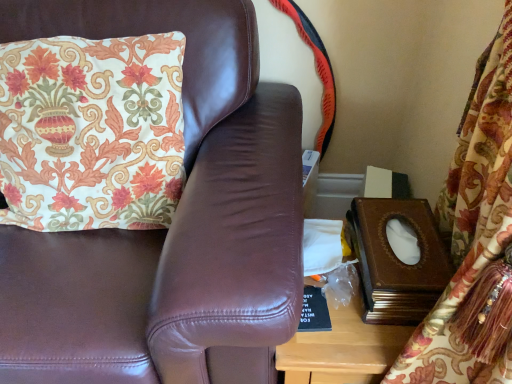
Question: Is brown leather couch at upper left oriented away from floral fabric cushion at upper left?

Choices:
 (A) no
 (B) yes

Answer: (B)

Question: Is brown leather couch at upper left aimed at floral fabric cushion at upper left?

Choices:
 (A) no
 (B) yes

Answer: (B)

Question: Considering the relative sizes of brown leather couch at upper left and floral fabric cushion at upper left in the image provided, is brown leather couch at upper left shorter than floral fabric cushion at upper left?

Choices:
 (A) yes
 (B) no

Answer: (B)

Question: From the image's perspective, does brown leather couch at upper left appear lower than floral fabric cushion at upper left?

Choices:
 (A) no
 (B) yes

Answer: (B)

Question: Considering the relative sizes of brown leather couch at upper left and floral fabric cushion at upper left in the image provided, is brown leather couch at upper left wider than floral fabric cushion at upper left?

Choices:
 (A) yes
 (B) no

Answer: (A)

Question: Is brown leather couch at upper left at the left side of floral fabric cushion at upper left?

Choices:
 (A) no
 (B) yes

Answer: (B)

Question: Is floral fabric cushion at upper left positioned far away from brown leather couch at upper left?

Choices:
 (A) no
 (B) yes

Answer: (A)

Question: Considering the relative positions of floral fabric cushion at upper left and brown leather couch at upper left in the image provided, is floral fabric cushion at upper left in front of brown leather couch at upper left?

Choices:
 (A) yes
 (B) no

Answer: (B)

Question: Is floral fabric cushion at upper left at the left side of brown leather couch at upper left?

Choices:
 (A) no
 (B) yes

Answer: (A)

Question: Is floral fabric cushion at upper left wider than brown leather couch at upper left?

Choices:
 (A) yes
 (B) no

Answer: (B)

Question: Can you confirm if floral fabric cushion at upper left is smaller than brown leather couch at upper left?

Choices:
 (A) yes
 (B) no

Answer: (A)

Question: Could you tell me if floral fabric cushion at upper left is facing brown leather couch at upper left?

Choices:
 (A) yes
 (B) no

Answer: (A)

Question: Would you say brown leather couch at upper left is inside or outside floral fabric cushion at upper left?

Choices:
 (A) inside
 (B) outside

Answer: (B)